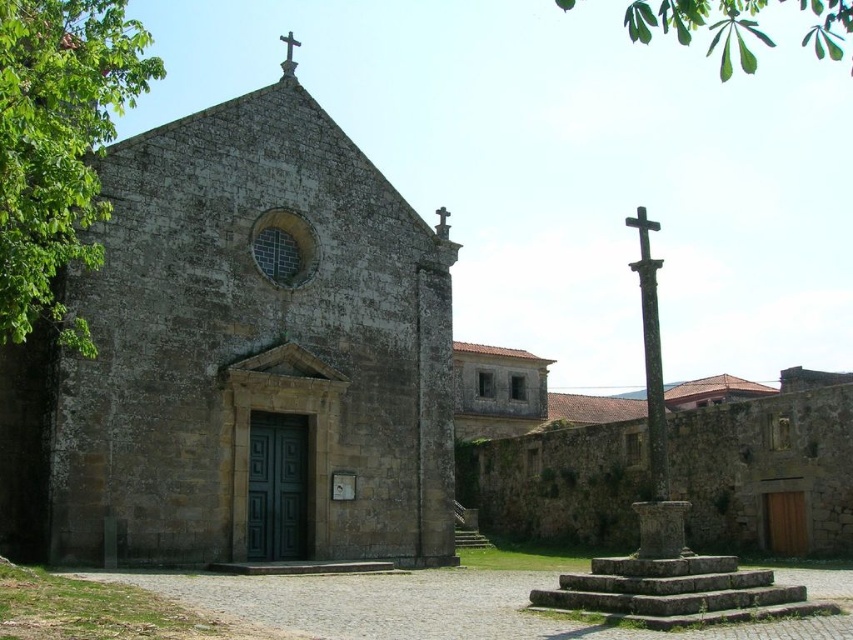
You are a tour guide leading a group to the stone church at center. You want to show them the black wood cross at upper right from the church. Can you see the cross from the church entrance without moving? Please explain.

A: The stone church at center and the black wood cross at upper right are 20.35 meters apart from each other. Since the distance is not too far, you can see the cross from the church entrance without needing to move.

You are an architect visiting the historic site. You need to determine which object would require more materials to construct between the stone church at center and the black wood cross at upper right. Based on their sizes, which one would need more materials?

The stone church at center is larger in size than the black wood cross at upper right, so it would require more materials to construct.